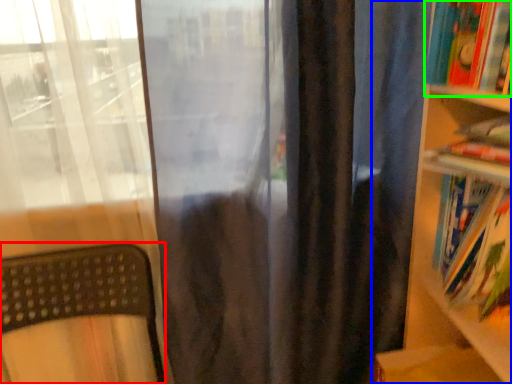
Question: Estimate the real-world distances between objects in this image. Which object is farther from furniture (highlighted by a red box), bookcase (highlighted by a blue box) or book (highlighted by a green box)?

Choices:
 (A) bookcase
 (B) book

Answer: (B)